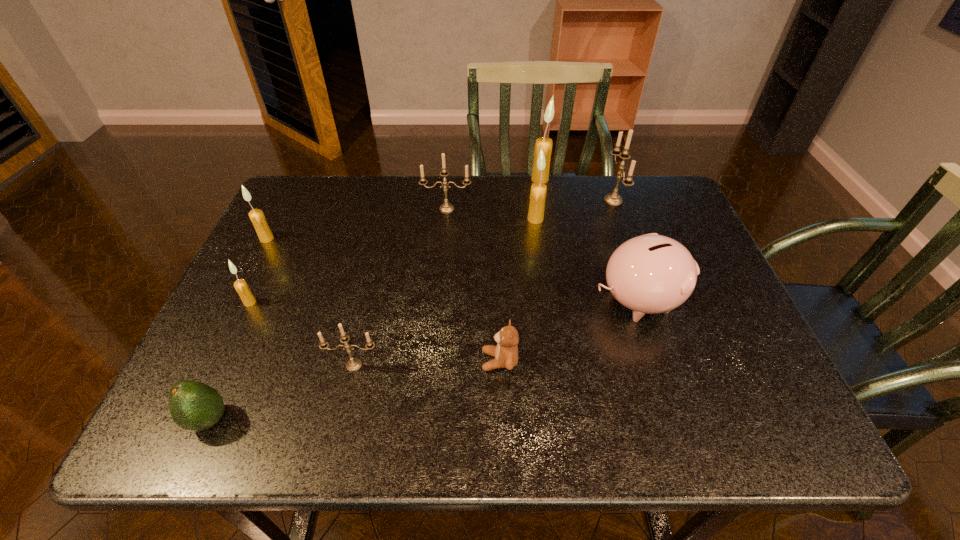
Where is `free space located on the front of the leftmost candle`? This screenshot has height=540, width=960. free space located on the front of the leftmost candle is located at coordinates (239, 293).

The height and width of the screenshot is (540, 960). Find the location of `vacant space situated 0.060m on the back of the fourth candle from left to right`. vacant space situated 0.060m on the back of the fourth candle from left to right is located at coordinates (448, 192).

Identify the location of vacant space located on the left of the pink piggy bank. This screenshot has height=540, width=960. (x=492, y=300).

This screenshot has height=540, width=960. I want to click on vacant space situated on the right of the sixth farthest candle, so click(379, 302).

Image resolution: width=960 pixels, height=540 pixels. I want to click on vacant space situated 0.260m on the left of the leftmost metallic candle, so click(x=203, y=364).

Identify the location of free spot located 0.300m on the front-facing side of the sixth object from left to right. (339, 361).

Locate an element on the screen. vacant space located 0.120m on the front-facing side of the sixth object from left to right is located at coordinates (424, 361).

Locate an element on the screen. blank area located 0.250m on the front-facing side of the sixth object from left to right is located at coordinates (363, 361).

Identify the location of free space located 0.340m on the right of the nearest object. Image resolution: width=960 pixels, height=540 pixels. (410, 420).

At what (x,y) coordinates should I click in order to perform the action: click on object positioned at the near edge. Please return your answer as a coordinate pair (x, y). Looking at the image, I should click on (194, 406).